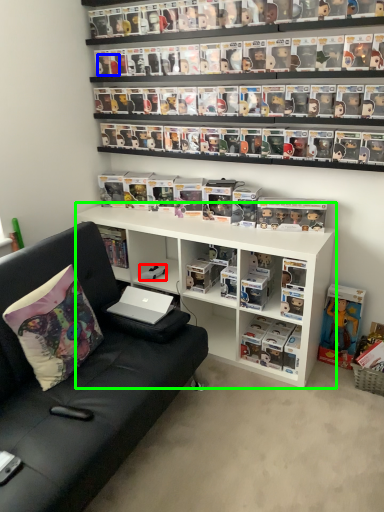
Question: Considering the real-world distances, which object is closest to toy (highlighted by a red box)? toy (highlighted by a blue box) or shelf (highlighted by a green box).

Choices:
 (A) toy
 (B) shelf

Answer: (B)